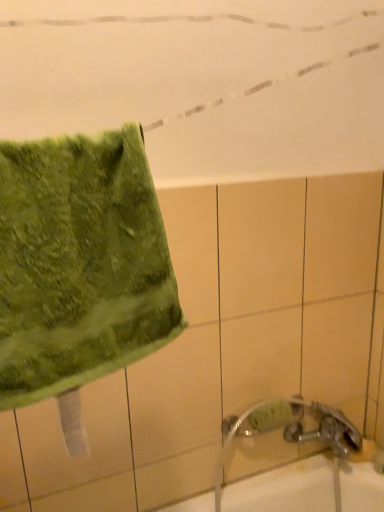
Question: Should I look upward or downward to see green fuzzy towel at left?

Choices:
 (A) down
 (B) up

Answer: (A)

Question: Is silver metallic faucet at lower right completely or partially outside of green fuzzy towel at left?

Choices:
 (A) no
 (B) yes

Answer: (B)

Question: Could you tell me if silver metallic faucet at lower right is turned towards green fuzzy towel at left?

Choices:
 (A) no
 (B) yes

Answer: (A)

Question: Does silver metallic faucet at lower right come behind green fuzzy towel at left?

Choices:
 (A) no
 (B) yes

Answer: (B)

Question: Are silver metallic faucet at lower right and green fuzzy towel at left far apart?

Choices:
 (A) no
 (B) yes

Answer: (A)

Question: Is silver metallic faucet at lower right oriented away from green fuzzy towel at left?

Choices:
 (A) no
 (B) yes

Answer: (A)

Question: Considering the relative sizes of silver metallic faucet at lower right and green fuzzy towel at left in the image provided, is silver metallic faucet at lower right smaller than green fuzzy towel at left?

Choices:
 (A) no
 (B) yes

Answer: (A)

Question: Can you confirm if green fuzzy towel at left is bigger than silver metallic faucet at lower right?

Choices:
 (A) no
 (B) yes

Answer: (A)

Question: Are green fuzzy towel at left and silver metallic faucet at lower right making contact?

Choices:
 (A) no
 (B) yes

Answer: (A)

Question: From a real-world perspective, is green fuzzy towel at left beneath silver metallic faucet at lower right?

Choices:
 (A) yes
 (B) no

Answer: (B)

Question: Does green fuzzy towel at left appear on the right side of silver metallic faucet at lower right?

Choices:
 (A) no
 (B) yes

Answer: (A)

Question: Is green fuzzy towel at left positioned before silver metallic faucet at lower right?

Choices:
 (A) no
 (B) yes

Answer: (B)

Question: Can you confirm if green fuzzy towel at left is shorter than silver metallic faucet at lower right?

Choices:
 (A) yes
 (B) no

Answer: (A)

Question: From the image's perspective, is silver metallic faucet at lower right positioned above or below green fuzzy towel at left?

Choices:
 (A) above
 (B) below

Answer: (B)